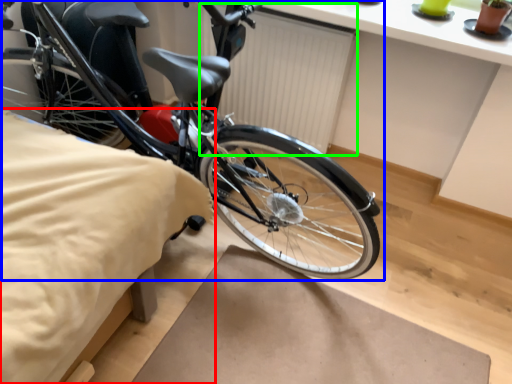
Question: Considering the real-world distances, which object is farthest from sheet (highlighted by a red box)? bicycle (highlighted by a blue box) or radiator (highlighted by a green box)?

Choices:
 (A) bicycle
 (B) radiator

Answer: (B)